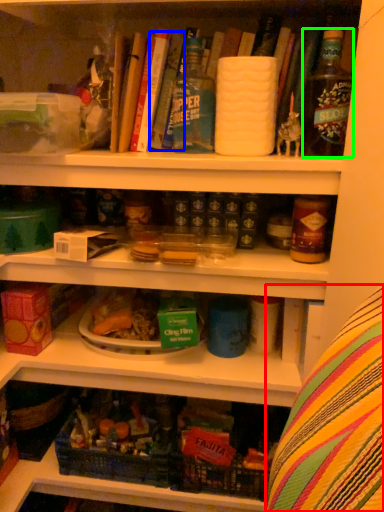
Question: Considering the real-world distances, which object is closest to leftover (highlighted by a red box)? book (highlighted by a blue box) or bottle (highlighted by a green box).

Choices:
 (A) book
 (B) bottle

Answer: (B)